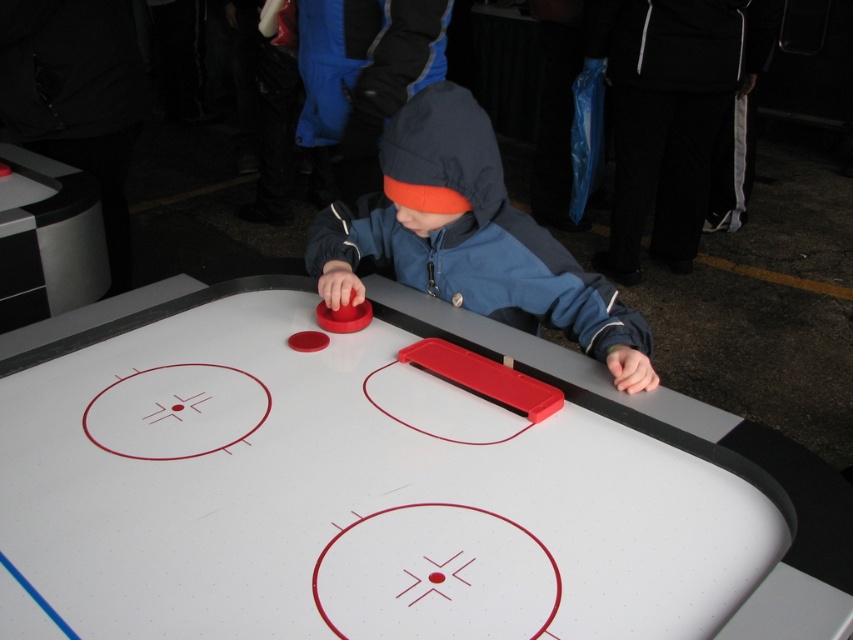
Which of these two, white glossy air hockey table at center or matte blue jacket at center, stands shorter?

white glossy air hockey table at center

Who is taller, white glossy air hockey table at center or matte blue jacket at center?

matte blue jacket at center

Is point (141, 630) positioned before point (602, 291)?

That is True.

Find the location of a particular element. Image resolution: width=853 pixels, height=640 pixels. white glossy air hockey table at center is located at coordinates (349, 486).